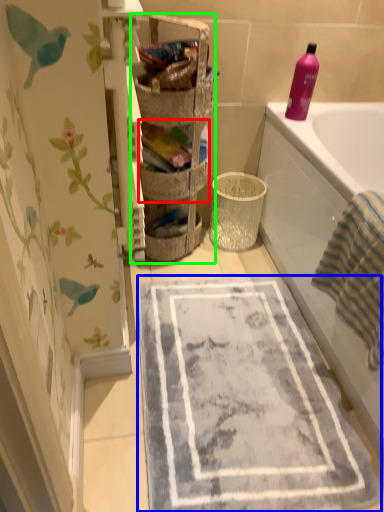
Question: Based on their relative distances, which object is nearer to basket (highlighted by a red box)? Choose from bath mat (highlighted by a blue box) and shelf (highlighted by a green box).

Choices:
 (A) bath mat
 (B) shelf

Answer: (B)